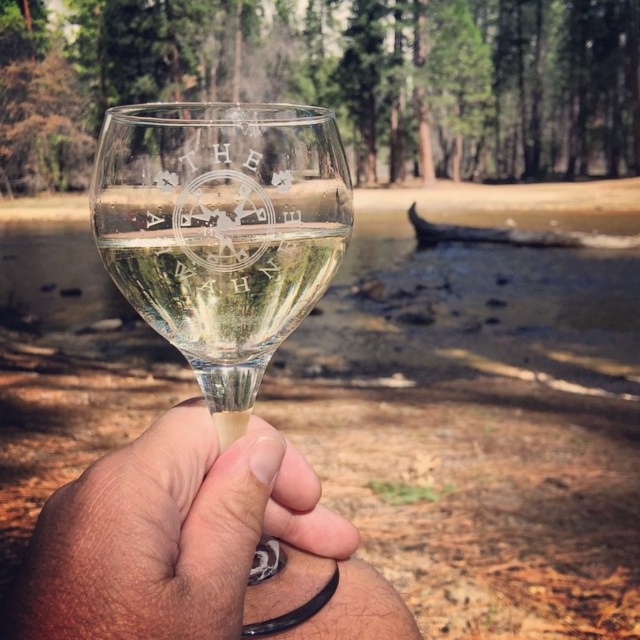
Please provide the exact 2D coordinates of the translucent glass at center in the image. The coordinates should be in the format of a tuple with two decimal numbers, such as 0.000 and 1.000 representing the image edges.

The exact 2D coordinates of the translucent glass at center are at point (195, 545).

Consider the image. You are a photographer trying to capture the engraved logo on the translucent glass at center and the clear glass wine glass at center. Which glass should you focus on first to ensure both are in sharp focus?

The translucent glass at center is closer to the viewer than the clear glass wine glass at center. To ensure both are in sharp focus, you should focus on the translucent glass at center first, as it is closer, and then adjust for the clear glass wine glass at center.

You are a bartender preparing a drink and notice two items in the image. One is the translucent glass at center and the other is the clear glass wine at center. Which item is positioned to the right of the other?

The translucent glass at center is positioned to the right of the clear glass wine at center.